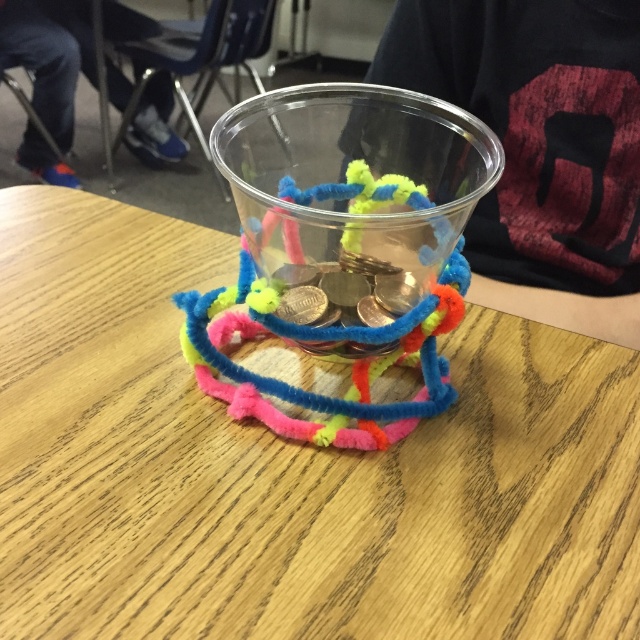
You are setting up a small centerpiece for a party. You have a wooden table at center and shiny metallic coins at center. Can you place the coins in the center of the table without them hanging over the edge?

The wooden table at center might be wider than shiny metallic coins at center, so there is a possibility that the coins can be placed in the center without hanging over the edge. However, since the exact dimensions are not provided, it is recommended to check the table size before placing the coins.

You are standing at the origin point in the image. Which direction should you move to reach the translucent plastic cup at center?

The translucent plastic cup at center is located at coordinates point (x=342, y=248). Since you are at the origin, you should move towards the positive x and y directions to reach it.